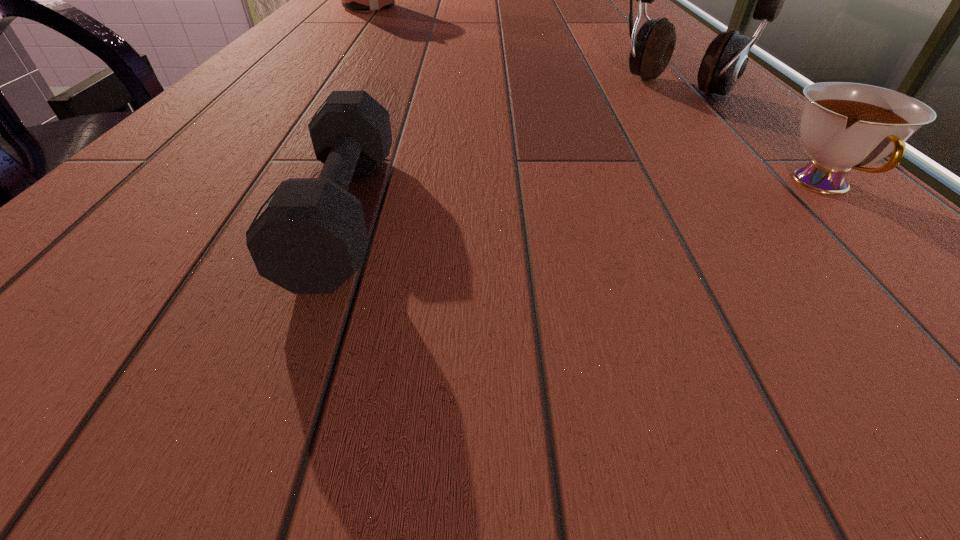
This screenshot has width=960, height=540. In order to click on free location located on the side with the handle of the leftmost object in this screenshot , I will do `click(384, 26)`.

I want to click on free location located on the ear pads of the second farthest object, so click(623, 126).

This screenshot has height=540, width=960. Find the location of `free space located 0.070m on the ear pads of the second farthest object`. free space located 0.070m on the ear pads of the second farthest object is located at coordinates (637, 116).

This screenshot has height=540, width=960. Find the location of `vacant position located on the ear pads of the second farthest object`. vacant position located on the ear pads of the second farthest object is located at coordinates (580, 159).

I want to click on object located at the far edge, so click(x=363, y=0).

At what (x,y) coordinates should I click in order to perform the action: click on object positioned at the near edge. Please return your answer as a coordinate pair (x, y). The width and height of the screenshot is (960, 540). Looking at the image, I should click on (309, 237).

Image resolution: width=960 pixels, height=540 pixels. I want to click on object present at the left edge, so click(x=363, y=0).

Image resolution: width=960 pixels, height=540 pixels. I want to click on teacup that is at the right edge, so click(x=844, y=125).

Locate an element on the screen. earphone that is positioned at the right edge is located at coordinates (725, 60).

Where is `object at the far left corner`? object at the far left corner is located at coordinates (363, 0).